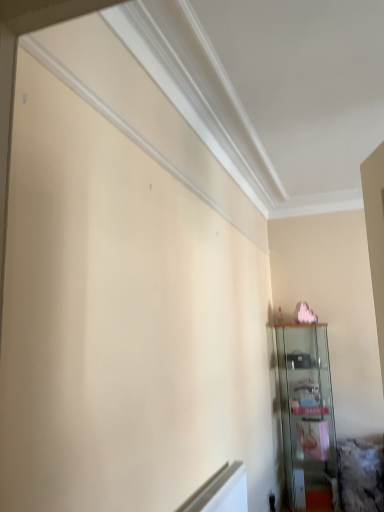
Question: Should I look upward or downward to see clear glass cabinet at right?

Choices:
 (A) up
 (B) down

Answer: (B)